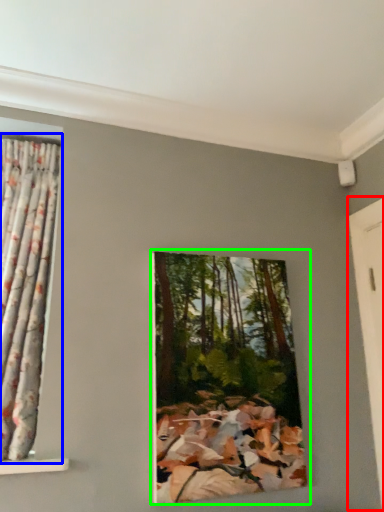
Question: Estimate the real-world distances between objects in this image. Which object is closer to door (highlighted by a red box), curtain (highlighted by a blue box) or oil painting (highlighted by a green box)?

Choices:
 (A) curtain
 (B) oil painting

Answer: (B)